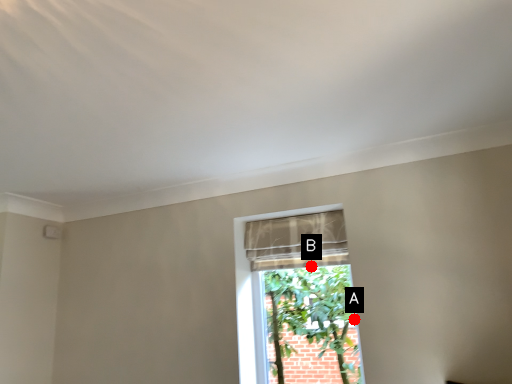
Question: Two points are circled on the image, labeled by A and B beside each circle. Which point appears closest to the camera in this image?

Choices:
 (A) A is closer
 (B) B is closer

Answer: (A)